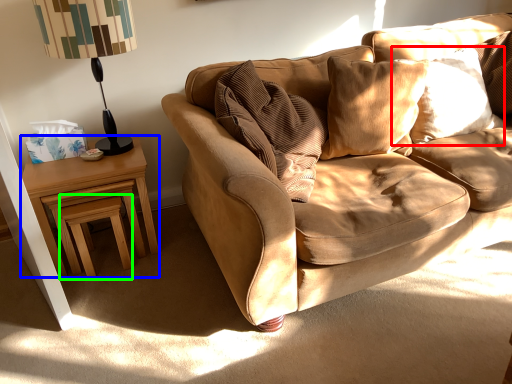
Question: Estimate the real-world distances between objects in this image. Which object is farther from pillow (highlighted by a red box), nightstand (highlighted by a blue box) or stool (highlighted by a green box)?

Choices:
 (A) nightstand
 (B) stool

Answer: (B)